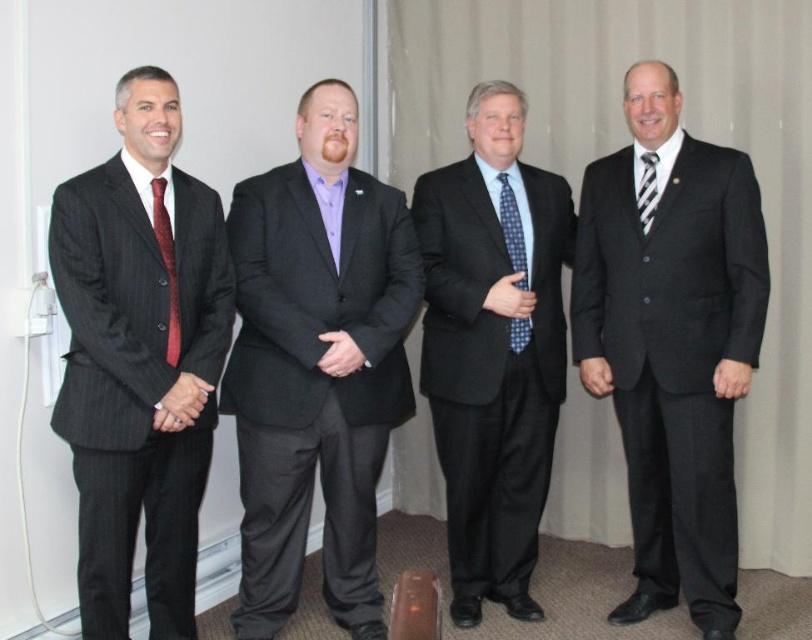
Which is above, matte black suit at right or pinstripe suit at left?

matte black suit at right is above.

What are the coordinates of `matte black suit at right` in the screenshot? It's located at (672, 342).

Is matte black suit at center to the right of matte black suit at right from the viewer's perspective?

Incorrect, matte black suit at center is not on the right side of matte black suit at right.

Does matte black suit at center appear on the left side of matte black suit at right?

Yes, matte black suit at center is to the left of matte black suit at right.

Does point (374, 454) come closer to viewer compared to point (577, 358)?

Yes.

The width and height of the screenshot is (812, 640). I want to click on matte black suit at center, so click(316, 365).

Who is more distant from viewer, (514, 141) or (504, 220)?

Positioned behind is point (514, 141).

What do you see at coordinates (493, 348) in the screenshot? This screenshot has height=640, width=812. I see `polka dot tie at center` at bounding box center [493, 348].

Find the location of `polka dot tie at center`. polka dot tie at center is located at coordinates (493, 348).